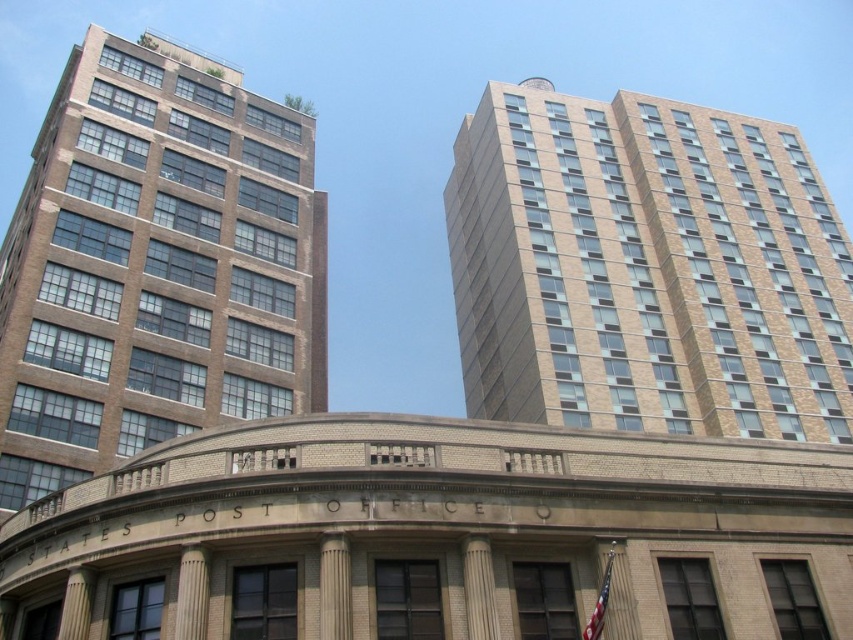
Which is more to the left, beige stone column at center or white marble column at lower left?

white marble column at lower left is more to the left.

Is beige stone column at center bigger than white marble column at lower left?

Indeed, beige stone column at center has a larger size compared to white marble column at lower left.

Measure the distance between point (202, 572) and camera.

Point (202, 572) and camera are 28.34 meters apart from each other.

This screenshot has height=640, width=853. Identify the location of beige stone column at center. (192, 593).

Which is above, brown brick building at left or smooth stone column at center?

brown brick building at left is above.

Where is `brown brick building at left`? This screenshot has width=853, height=640. brown brick building at left is located at coordinates (155, 264).

Who is more forward, (316, 390) or (334, 566)?

Positioned in front is point (334, 566).

Where is `brown brick building at left`? The width and height of the screenshot is (853, 640). brown brick building at left is located at coordinates (155, 264).

Can you confirm if white marble column at center is shorter than beige stone column at center?

No.

What do you see at coordinates (479, 588) in the screenshot? I see `white marble column at center` at bounding box center [479, 588].

Find the location of `white marble column at center`. white marble column at center is located at coordinates (479, 588).